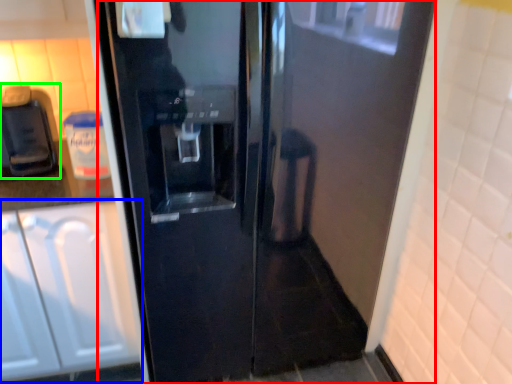
Question: Based on their relative distances, which object is farther from door (highlighted by a red box)? Choose from cabinetry (highlighted by a blue box) and coffee machine (highlighted by a green box).

Choices:
 (A) cabinetry
 (B) coffee machine

Answer: (B)